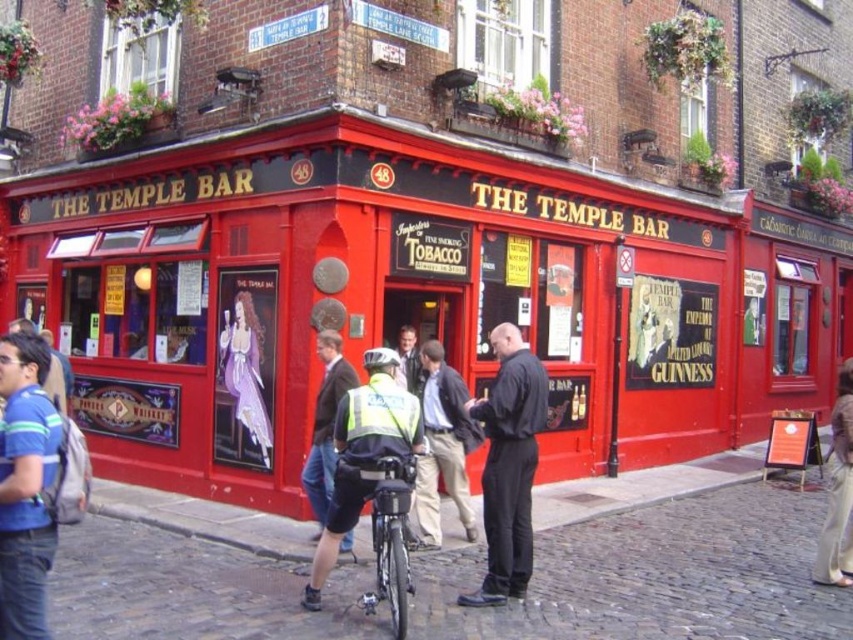
Question: Does shiny black bicycle at center come behind reflective yellow vest at center?

Choices:
 (A) no
 (B) yes

Answer: (A)

Question: Does matte red building at center lie in front of shiny black bicycle at center?

Choices:
 (A) no
 (B) yes

Answer: (A)

Question: Which of the following is the closest to the observer?

Choices:
 (A) (410, 337)
 (B) (399, 545)
 (C) (45, 448)

Answer: (C)

Question: Can you confirm if matte red building at center is smaller than light brown leather jacket at center?

Choices:
 (A) yes
 (B) no

Answer: (B)

Question: Which point is farther to the camera?

Choices:
 (A) (421, 390)
 (B) (383, 536)

Answer: (A)

Question: Among these points, which one is nearest to the camera?

Choices:
 (A) (323, 445)
 (B) (433, 465)
 (C) (344, 472)
 (D) (56, 410)

Answer: (D)